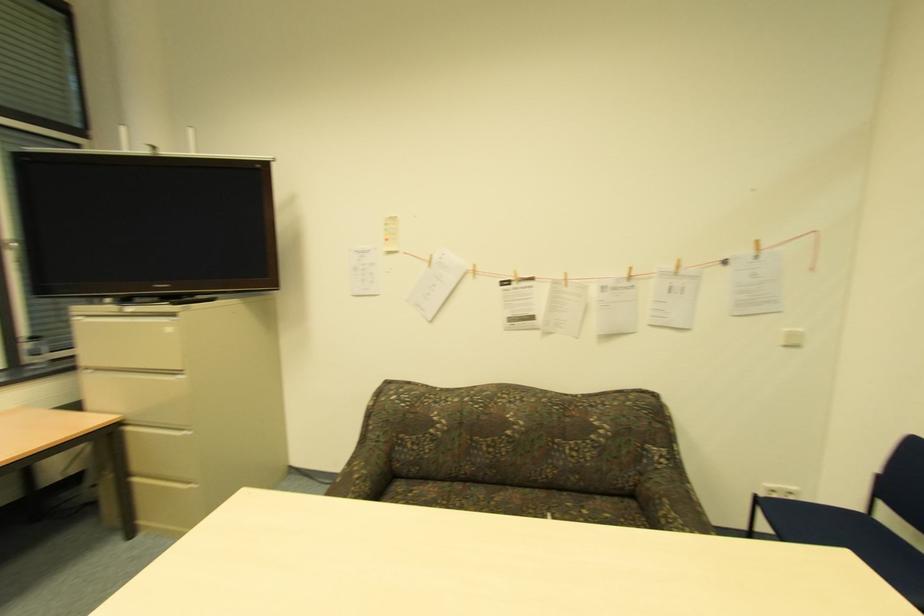
Find where to sit the sofa sitting surface. Please return your answer as a coordinate pair (x, y).

(514, 500)